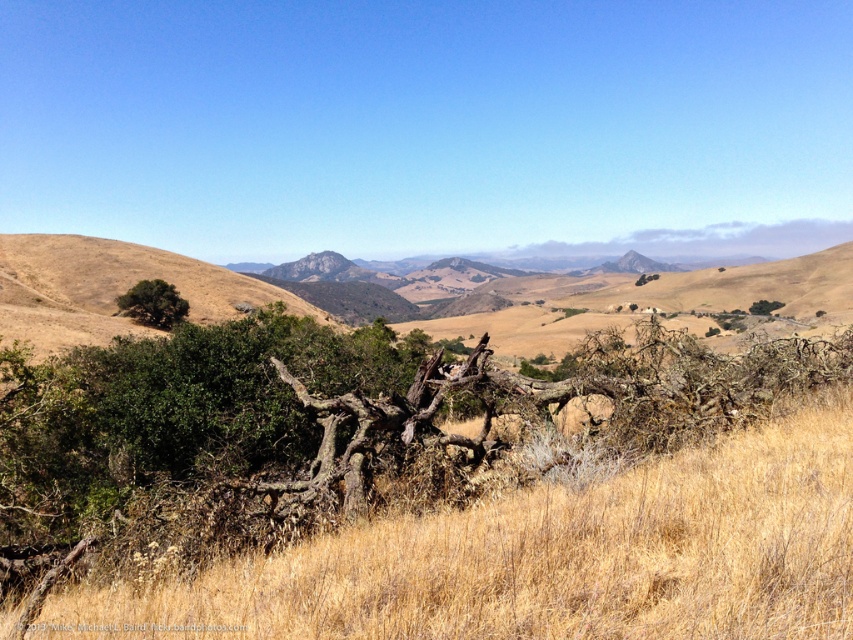
Question: Does green leafy tree at left have a lesser width compared to green rough bark tree at center-right?

Choices:
 (A) no
 (B) yes

Answer: (A)

Question: Which object is closer to the camera taking this photo?

Choices:
 (A) green leafy tree at left
 (B) dry grass at center

Answer: (B)

Question: In this image, where is dry grass at center located relative to green leafy tree at left?

Choices:
 (A) left
 (B) right

Answer: (B)

Question: Which point is closer to the camera taking this photo?

Choices:
 (A) (164, 308)
 (B) (260, 618)

Answer: (B)

Question: Which of the following is the closest to the observer?

Choices:
 (A) green leafy tree at left
 (B) green rough bark tree at center-right
 (C) dry grass at center

Answer: (C)

Question: Considering the relative positions of green leafy tree at left and green rough bark tree at center-right in the image provided, where is green leafy tree at left located with respect to green rough bark tree at center-right?

Choices:
 (A) left
 (B) right

Answer: (A)